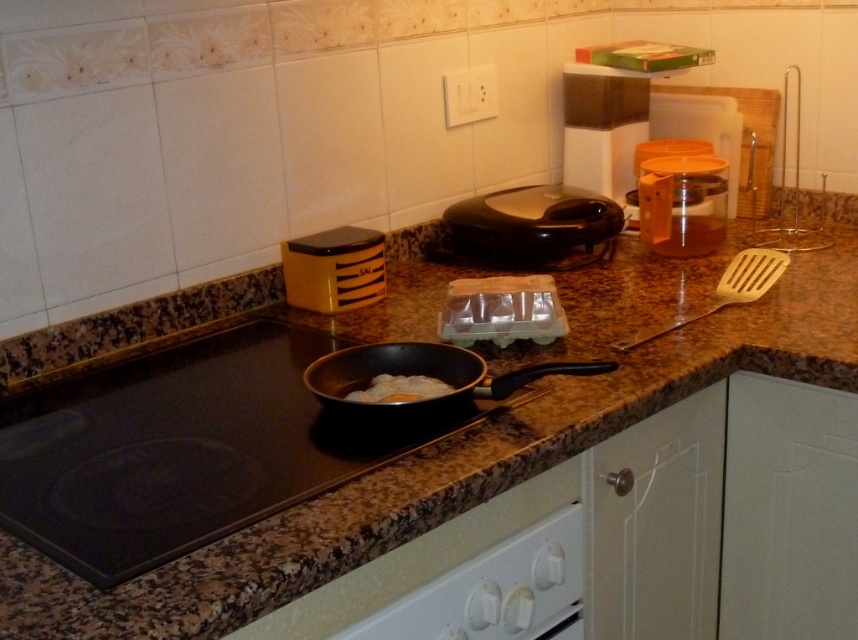
You are a chef preparing a dish and need to reach for the wooden spatula at right. From your current position at the brown granite countertop at center, which direction should you move to grab it?

The wooden spatula at right is behind the brown granite countertop at center, so you should move backward to reach it.